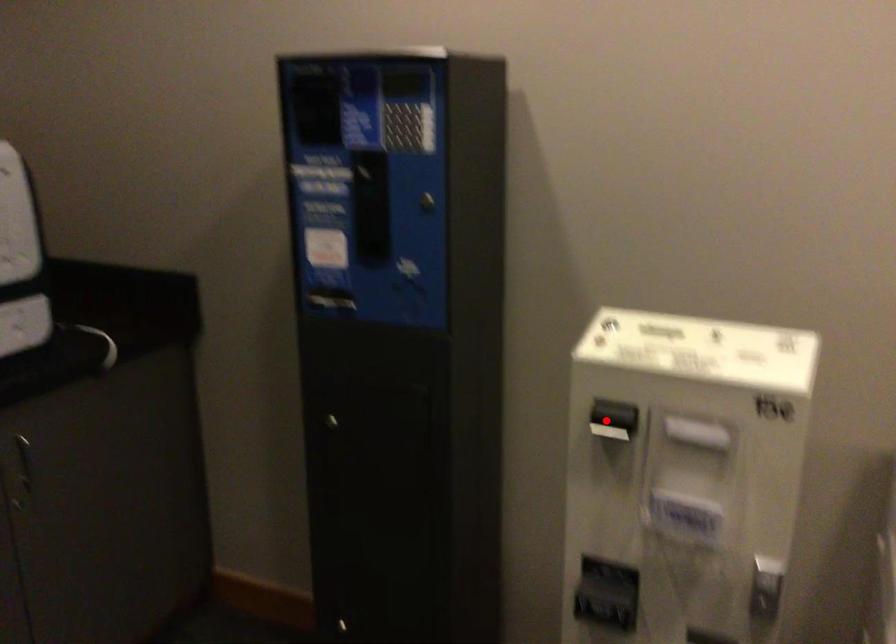
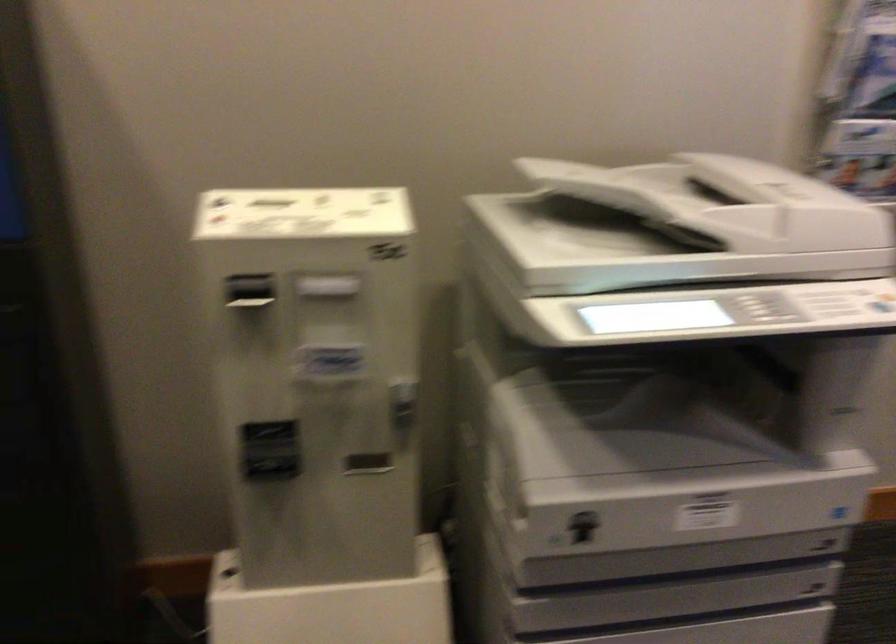
The point at the highlighted location is marked in the first image. Where is the corresponding point in the second image?

(250, 292)